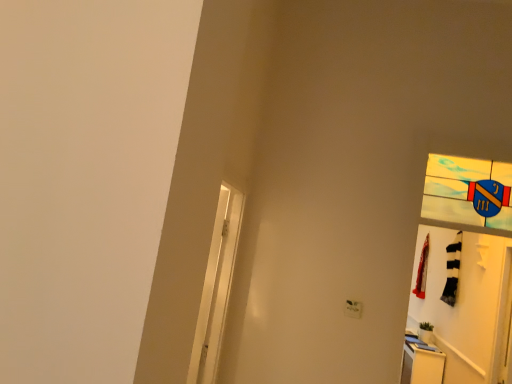
Question: Does red fabric laundry at right have a smaller size compared to white glossy dresser at lower right?

Choices:
 (A) yes
 (B) no

Answer: (A)

Question: Is red fabric laundry at right taller than white glossy dresser at lower right?

Choices:
 (A) yes
 (B) no

Answer: (A)

Question: Does red fabric laundry at right have a greater width compared to white glossy dresser at lower right?

Choices:
 (A) yes
 (B) no

Answer: (B)

Question: Can you confirm if red fabric laundry at right is bigger than white glossy dresser at lower right?

Choices:
 (A) yes
 (B) no

Answer: (B)

Question: From a real-world perspective, is red fabric laundry at right physically below white glossy dresser at lower right?

Choices:
 (A) no
 (B) yes

Answer: (A)

Question: Is red fabric laundry at right placed right next to white glossy dresser at lower right?

Choices:
 (A) yes
 (B) no

Answer: (B)

Question: Can you confirm if white matte door at right is thinner than white glossy screen door at left?

Choices:
 (A) yes
 (B) no

Answer: (A)

Question: Is white matte door at right smaller than white glossy screen door at left?

Choices:
 (A) no
 (B) yes

Answer: (B)

Question: From the image's perspective, is white matte door at right over white glossy screen door at left?

Choices:
 (A) no
 (B) yes

Answer: (A)

Question: Does white matte door at right have a greater height compared to white glossy screen door at left?

Choices:
 (A) yes
 (B) no

Answer: (B)

Question: Does white matte door at right have a lesser height compared to white glossy screen door at left?

Choices:
 (A) yes
 (B) no

Answer: (A)

Question: Is white matte door at right not inside white glossy screen door at left?

Choices:
 (A) no
 (B) yes

Answer: (B)

Question: Is white glossy screen door at left far from red fabric laundry at right?

Choices:
 (A) yes
 (B) no

Answer: (A)